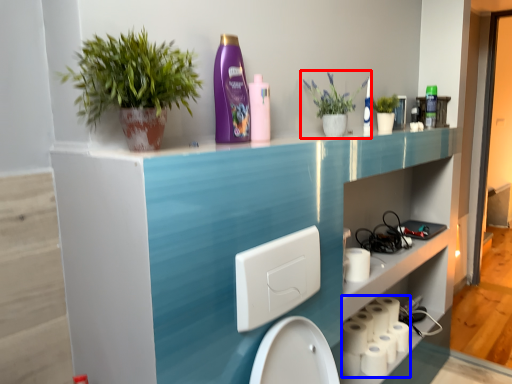
Question: Which point is closer to the camera, houseplant (highlighted by a red box) or toilet paper (highlighted by a blue box)?

Choices:
 (A) houseplant
 (B) toilet paper

Answer: (A)